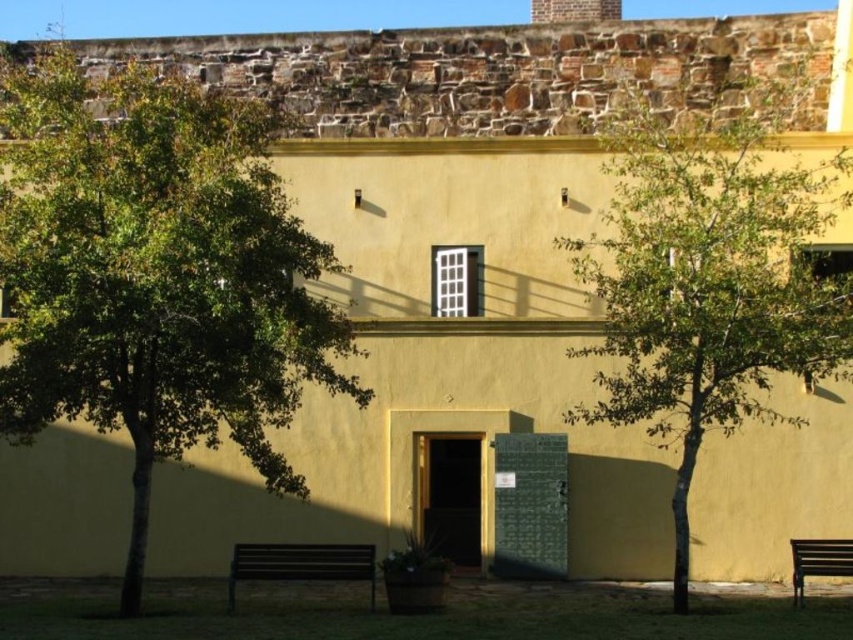
From the picture: You are a gardener who needs to water both the green leafy tree at left and the green leafy tree at center. You have a watering can that can hold enough water to cover 10 meters between two trees. Can you water both trees without needing to refill your watering can?

The distance between the green leafy tree at left and the green leafy tree at center is 11.36 meters, which exceeds the watering can capacity of 10 meters. Therefore, you will need to refill your watering can before watering both trees.

You are standing at the entrance of the yellow building. You want to walk directly towards the green leafy tree at center. Which direction should you walk relative to the door with a dark frame?

Since the green leafy tree at center is positioned at point (x=711, y=275), you should walk forward and slightly to the right relative to the door with a dark frame to reach it.